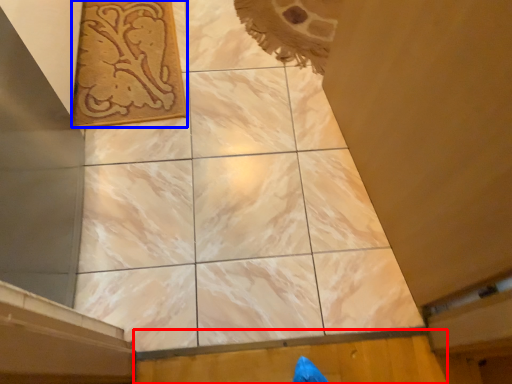
Question: Which point is further to the camera, plywood (highlighted by a red box) or design (highlighted by a blue box)?

Choices:
 (A) plywood
 (B) design

Answer: (B)